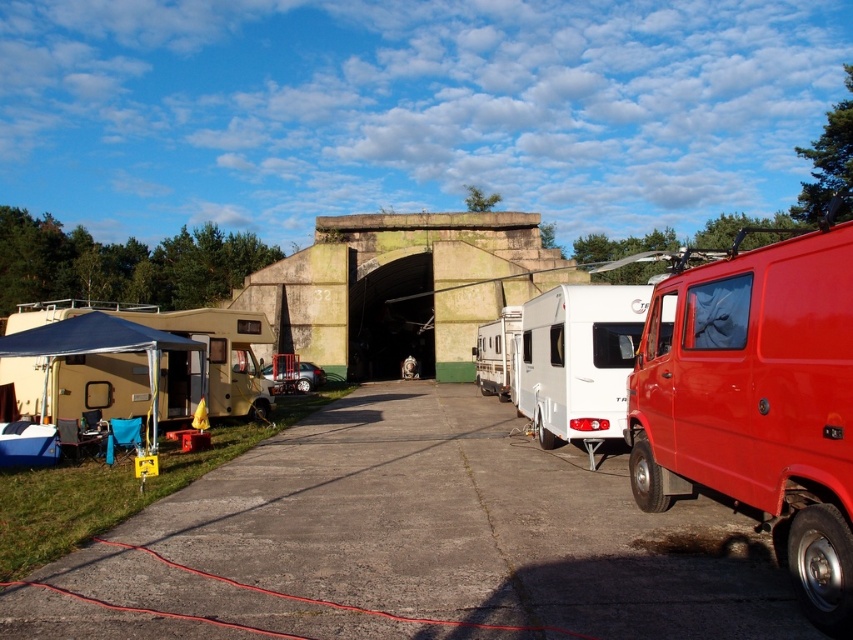
Question: Is shiny red van at right positioned at the back of white glossy camper at center?

Choices:
 (A) yes
 (B) no

Answer: (B)

Question: Among these points, which one is nearest to the camera?

Choices:
 (A) (535, 417)
 (B) (810, 474)

Answer: (B)

Question: Is shiny red van at right thinner than white glossy camper at center?

Choices:
 (A) yes
 (B) no

Answer: (B)

Question: Which point is closer to the camera?

Choices:
 (A) white glossy camper at center
 (B) shiny red van at right

Answer: (B)

Question: Can you confirm if shiny red van at right is bigger than white glossy camper at center?

Choices:
 (A) yes
 (B) no

Answer: (A)

Question: Which point is closer to the camera?

Choices:
 (A) shiny red van at right
 (B) white glossy camper at center

Answer: (A)